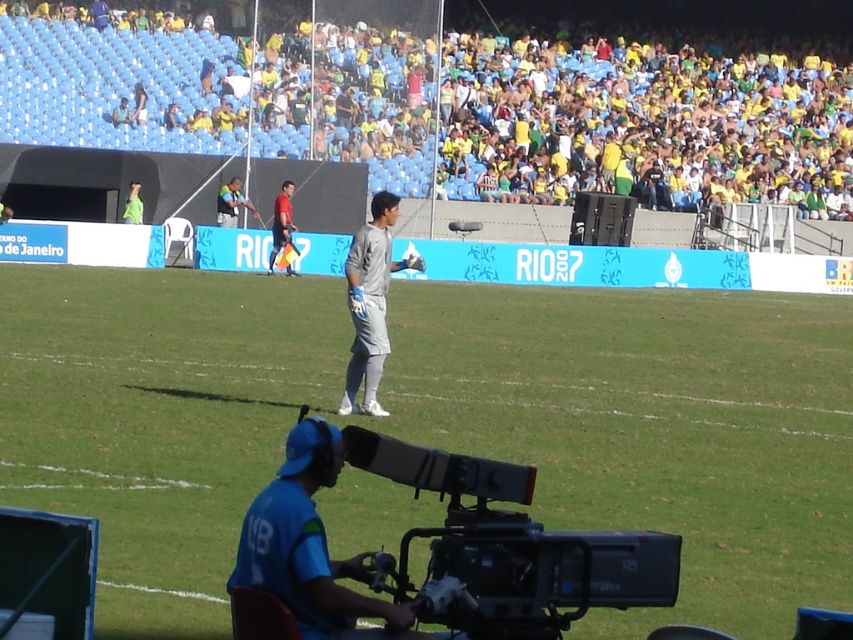
From the picture: You are a soccer player trying to determine your position relative to two points marked on the field. The points are labeled as point 1 at coordinates point (288, 228) and point 2 at coordinates point (218, 209). Which point is closer to you?

Point 1 at coordinates point (288, 228) is closer to you than point 2 at coordinates point (218, 209).

You are a soccer coach analyzing the match from the sidelines. You notice a player wearing a red shirt at center. Can you determine the exact coordinates of this player?

The red shirt at center is located at coordinates point (281, 221).